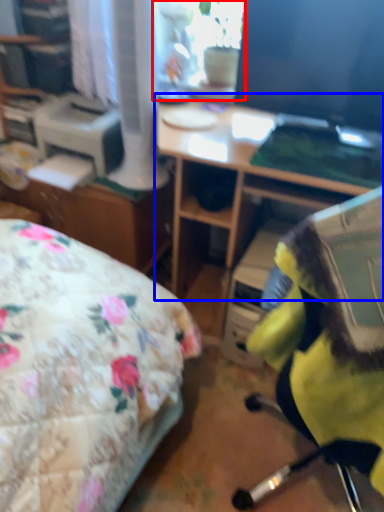
Question: Which of the following is the farthest to the observer, window screen (highlighted by a red box) or desk (highlighted by a blue box)?

Choices:
 (A) window screen
 (B) desk

Answer: (A)